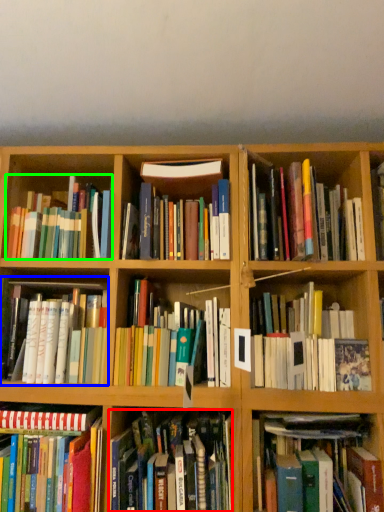
Question: Based on their relative distances, which object is farther from book (highlighted by a red box)? Choose from book (highlighted by a blue box) and book (highlighted by a green box).

Choices:
 (A) book
 (B) book

Answer: (B)